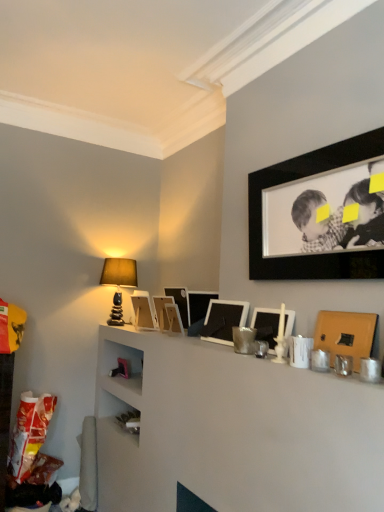
Question: Does matte stone table lamp at upper left come behind wooden picture frame at center, positioned as the 3th picture frame in back-to-front order?

Choices:
 (A) yes
 (B) no

Answer: (A)

Question: From a real-world perspective, is matte stone table lamp at upper left beneath wooden picture frame at center, positioned as the 3th picture frame in back-to-front order?

Choices:
 (A) no
 (B) yes

Answer: (A)

Question: Is matte stone table lamp at upper left facing away from wooden picture frame at center, positioned as the sixth picture frame in front-to-back order?

Choices:
 (A) yes
 (B) no

Answer: (B)

Question: Is matte stone table lamp at upper left far away from wooden picture frame at center, positioned as the sixth picture frame in front-to-back order?

Choices:
 (A) no
 (B) yes

Answer: (A)

Question: Is matte stone table lamp at upper left not within wooden picture frame at center, positioned as the sixth picture frame in front-to-back order?

Choices:
 (A) no
 (B) yes

Answer: (B)

Question: Is matte white picture frame at upper center, the first picture frame from the back, wider or thinner than matte white picture frame at center, the third picture frame positioned from the front?

Choices:
 (A) thin
 (B) wide

Answer: (B)

Question: From the image's perspective, is matte white picture frame at upper center, the first picture frame from the back, located above or below matte white picture frame at center, positioned as the sixth picture frame in back-to-front order?

Choices:
 (A) above
 (B) below

Answer: (B)

Question: Is point (134, 296) positioned closer to the camera than point (289, 314)?

Choices:
 (A) closer
 (B) farther

Answer: (B)

Question: In terms of height, does matte white picture frame at upper center, the first picture frame from the back, look taller or shorter compared to matte white picture frame at center, positioned as the sixth picture frame in back-to-front order?

Choices:
 (A) tall
 (B) short

Answer: (A)

Question: Is point (200, 290) positioned closer to the camera than point (152, 313)?

Choices:
 (A) farther
 (B) closer

Answer: (A)

Question: Relative to matte white picture frame at upper center, acting as the 8th picture frame starting from the front, is matte black picture frame at center, which is the 5th picture frame in front-to-back order, in front or behind?

Choices:
 (A) front
 (B) behind

Answer: (A)

Question: Is matte black picture frame at center, which is the 5th picture frame in front-to-back order, taller or shorter than matte white picture frame at upper center, acting as the 8th picture frame starting from the front?

Choices:
 (A) tall
 (B) short

Answer: (A)

Question: From the image's perspective, is matte black picture frame at center, which appears as the fourth picture frame when viewed from the back, positioned above or below matte white picture frame at upper center, the first picture frame from the back?

Choices:
 (A) below
 (B) above

Answer: (B)

Question: Is wooden picture frame at center, positioned as the sixth picture frame in front-to-back order, taller or shorter than matte black picture frame at center, placed as the fifth picture frame when sorted from back to front?

Choices:
 (A) short
 (B) tall

Answer: (A)

Question: Considering their positions, is wooden picture frame at center, positioned as the 3th picture frame in back-to-front order, located in front of or behind matte black picture frame at center, the fourth picture frame positioned from the front?

Choices:
 (A) behind
 (B) front

Answer: (A)